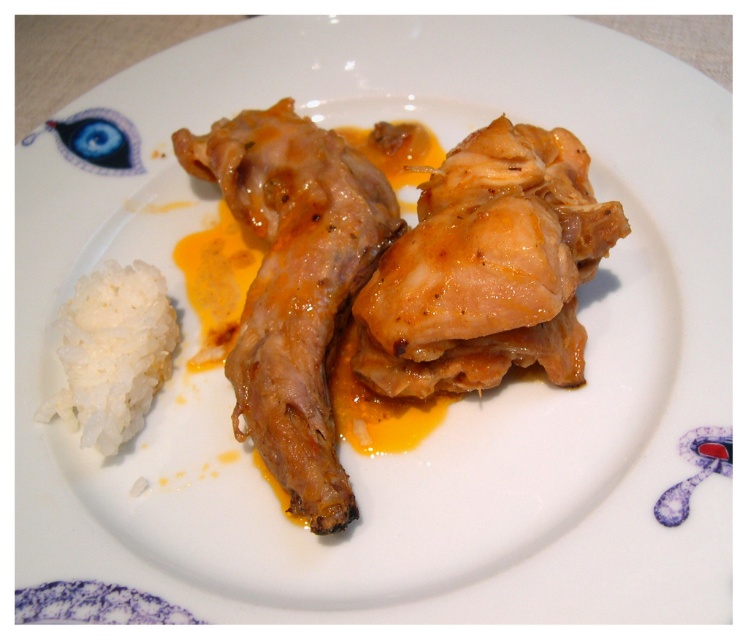
Question: In this image, where is glossy brown chicken wing at center located relative to white/sticky rice at lower left?

Choices:
 (A) left
 (B) right

Answer: (B)

Question: Is glossy brown chicken wing at center to the right of white/sticky rice at lower left from the viewer's perspective?

Choices:
 (A) yes
 (B) no

Answer: (A)

Question: Which object is closer to the camera taking this photo?

Choices:
 (A) glossy brown chicken wing at center
 (B) white/sticky rice at lower left

Answer: (A)

Question: Which point is closer to the camera?

Choices:
 (A) glossy brown chicken wing at center
 (B) white/sticky rice at lower left

Answer: (A)

Question: Does glossy brown chicken wing at center have a lesser width compared to white/sticky rice at lower left?

Choices:
 (A) yes
 (B) no

Answer: (B)